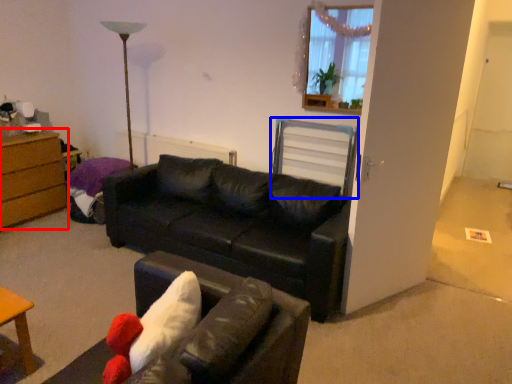
Question: Among these objects, which one is nearest to the camera, chest of drawers (highlighted by a red box) or swivel chair (highlighted by a blue box)?

Choices:
 (A) chest of drawers
 (B) swivel chair

Answer: (B)